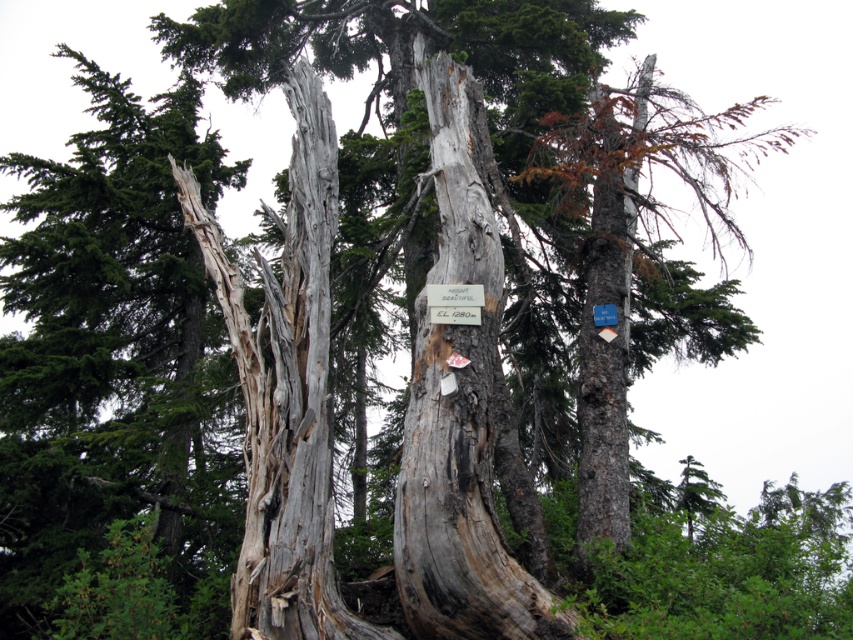
Question: Considering the real-world distances, which object is farthest from the green wood sign at center?

Choices:
 (A) white paper sign at center
 (B) gray rough bark tree trunk at center

Answer: (A)

Question: Based on their relative distances, which object is farther from the white paper sign at center?

Choices:
 (A) green wood sign at center
 (B) gray rough bark tree trunk at center

Answer: (B)

Question: Which object appears closest to the camera in this image?

Choices:
 (A) white paper sign at center
 (B) green wood sign at center
 (C) gray rough bark tree trunk at center

Answer: (C)

Question: Where is green wood sign at center located in relation to white paper sign at center in the image?

Choices:
 (A) right
 (B) left

Answer: (B)

Question: Is gray rough bark tree trunk at center above green wood sign at center?

Choices:
 (A) no
 (B) yes

Answer: (B)

Question: Is green wood sign at center below white paper sign at center?

Choices:
 (A) no
 (B) yes

Answer: (A)